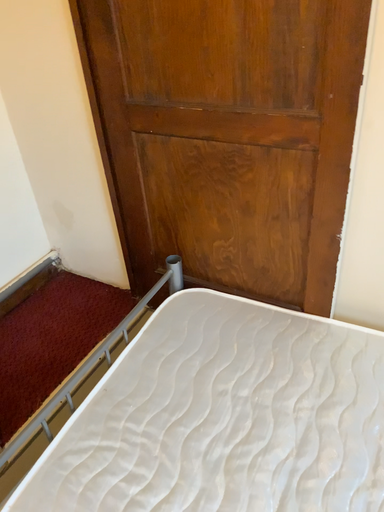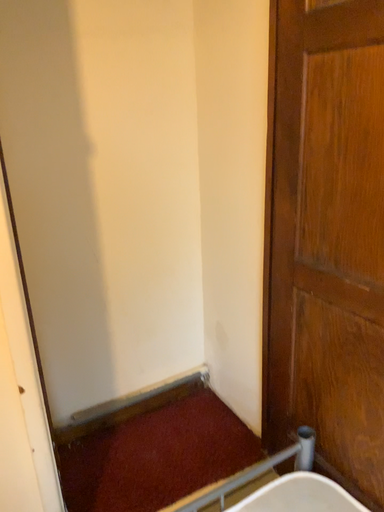
Question: Which way did the camera rotate in the video?

Choices:
 (A) rotated downward
 (B) rotated upward

Answer: (B)